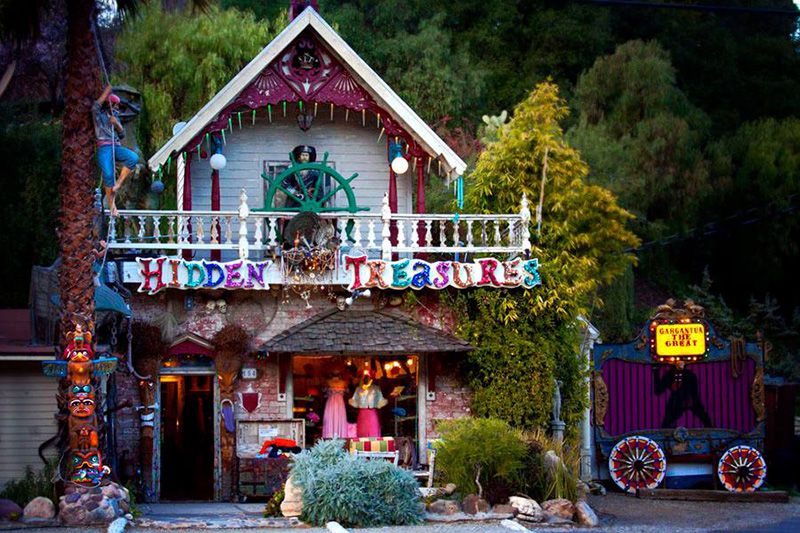
Where is `light globes`? This screenshot has width=800, height=533. light globes is located at coordinates (398, 165), (218, 160).